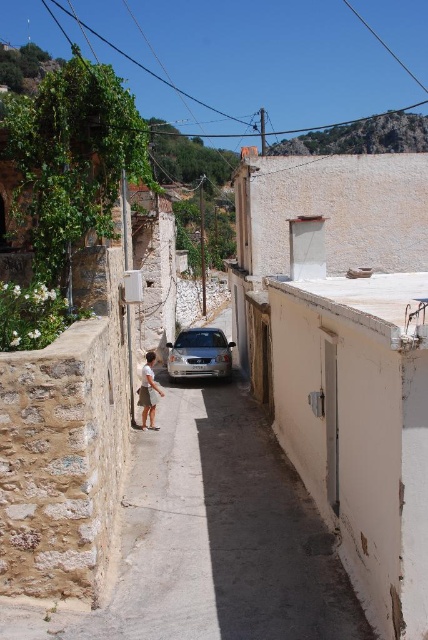
Does smooth concrete alley at center have a smaller size compared to silver metallic car at center?

No, smooth concrete alley at center is not smaller than silver metallic car at center.

Does smooth concrete alley at center have a lesser height compared to silver metallic car at center?

Indeed, smooth concrete alley at center has a lesser height compared to silver metallic car at center.

Identify the location of smooth concrete alley at center. (223, 538).

Which is in front, point (246, 413) or point (140, 378)?

Point (246, 413) is in front.

Who is more distant from viewer, [237,476] or [148,412]?

Positioned behind is point [148,412].

Image resolution: width=428 pixels, height=640 pixels. What do you see at coordinates (223, 538) in the screenshot?
I see `smooth concrete alley at center` at bounding box center [223, 538].

Identify the location of smooth concrete alley at center. The height and width of the screenshot is (640, 428). (223, 538).

Is point (178, 336) behind point (142, 412)?

Yes, it is.

Between silver metallic car at center and white cotton shirt at center, which one is positioned higher?

silver metallic car at center is higher up.

You are a GUI agent. You are given a task and a screenshot of the screen. Output one action in this format:
    pyautogui.click(x=<x>, y=<y>)
    Task: Click on the silver metallic car at center
    The width and height of the screenshot is (428, 640).
    Given the screenshot: What is the action you would take?
    pyautogui.click(x=199, y=355)